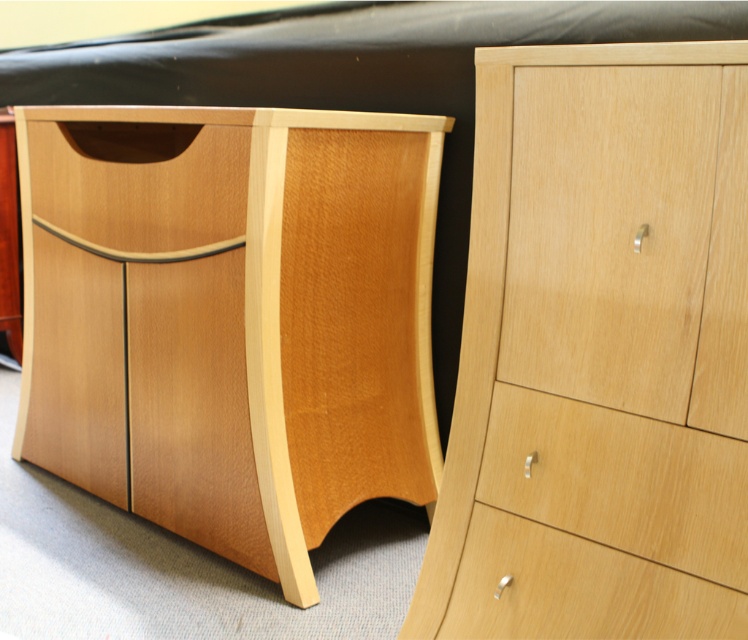
You are organizing a small box and need to choose between the light brown wood drawer at center right and the light wood drawer at center. Which drawer should you choose if you want the one with more space inside?

The light wood drawer at center has a greater width than the light brown wood drawer at center right, so it has more space inside. Choose the light wood drawer at center.

You are standing in front of the two wooden furniture pieces. You need to reach the light brown wood drawer at center right and the light wood drawer at center. Which drawer should you reach for first based on their positions?

You should reach for the light brown wood drawer at center right first because it is closer to you than the light wood drawer at center.

You are organizing a bedroom and need to place a new lamp on the light wood drawer at center. However, you also have a decorative vase that needs to go on the light brown wood drawer at center right. Based on their positions, which drawer is located to the right of the other?

The light brown wood drawer at center right is positioned on the right side of the light wood drawer at center, so the light brown wood drawer at center right is to the right of the light wood drawer at center.